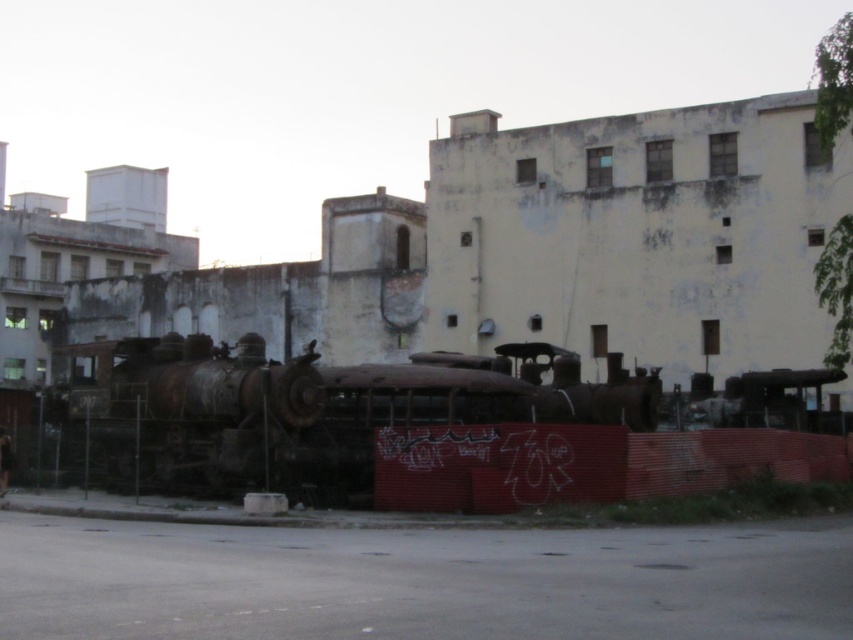
You are a city planner analyzing an old industrial area. You need to determine if the rusty metal train at center and the rusty metal steam locomotive at left can fit side by side on a track that is 10 meters wide. Can they fit?

The rusty metal train at center might be wider than the rusty metal steam locomotive at left, so their combined width could exceed 10 meters. Further measurements are needed to confirm.

You are a photographer planning to take a picture of the rusty metal train at center and the rusty metal steam locomotive at left. You want to ensure both are visible in the frame. Based on their positions, which one should you focus on first to capture both in the shot?

The rusty metal train at center is positioned on the right side of the rusty metal steam locomotive at left. Therefore, to capture both in the frame, you should focus on the rusty metal steam locomotive at left first as it is on the left side and the other is to its right, ensuring both are within the shot.

You are a maintenance worker inspecting the area. You notice the rusty metal train at center and the rusty metal steam locomotive at left. Which object is located above the other?

The rusty metal steam locomotive at left is above the rusty metal train at center because the description states that the rusty metal train at center is positioned under the rusty metal steam locomotive at left.